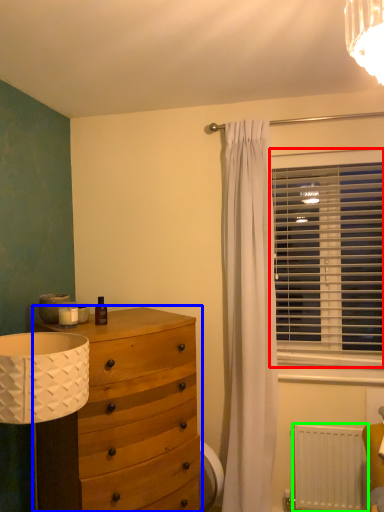
Question: Which object is positioned farthest from window blind (highlighted by a red box)? Select from chest of drawers (highlighted by a blue box) and radiator (highlighted by a green box).

Choices:
 (A) chest of drawers
 (B) radiator

Answer: (A)